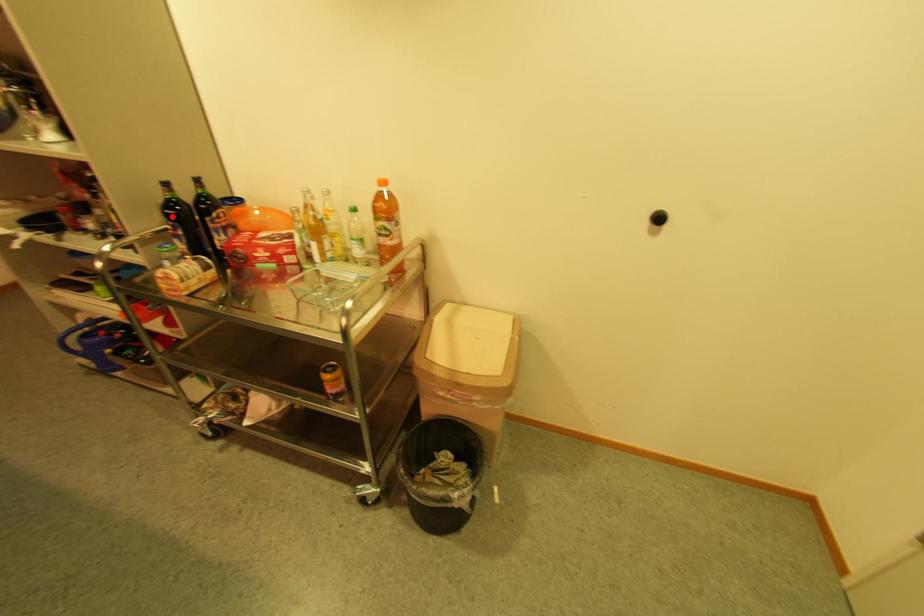
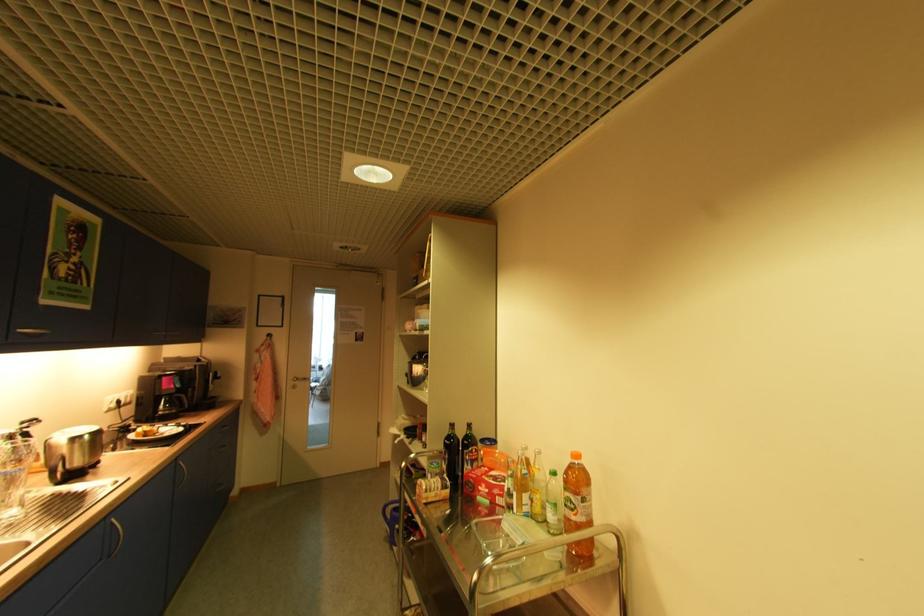
Locate, in the second image, the point that corresponds to the highlighted location in the first image.

(451, 445)